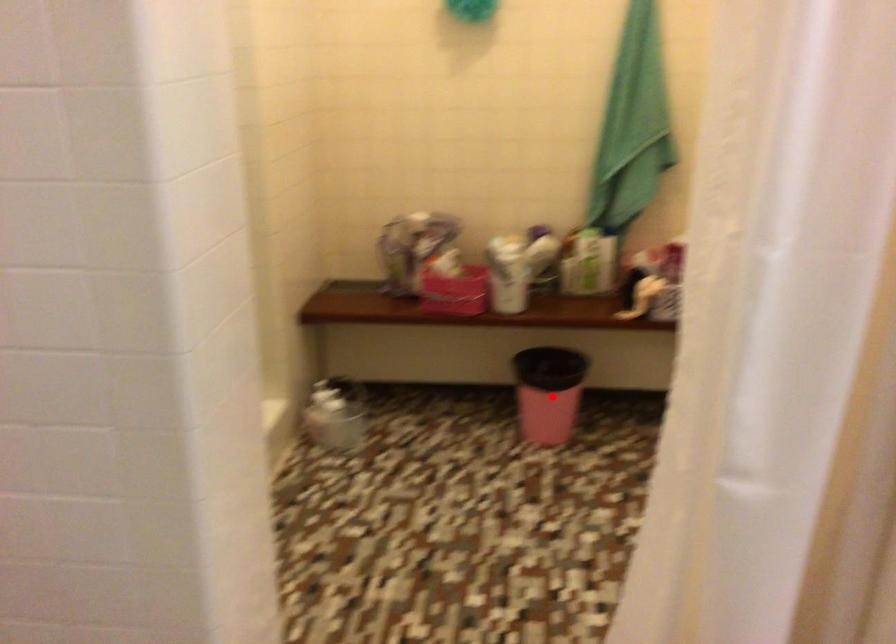
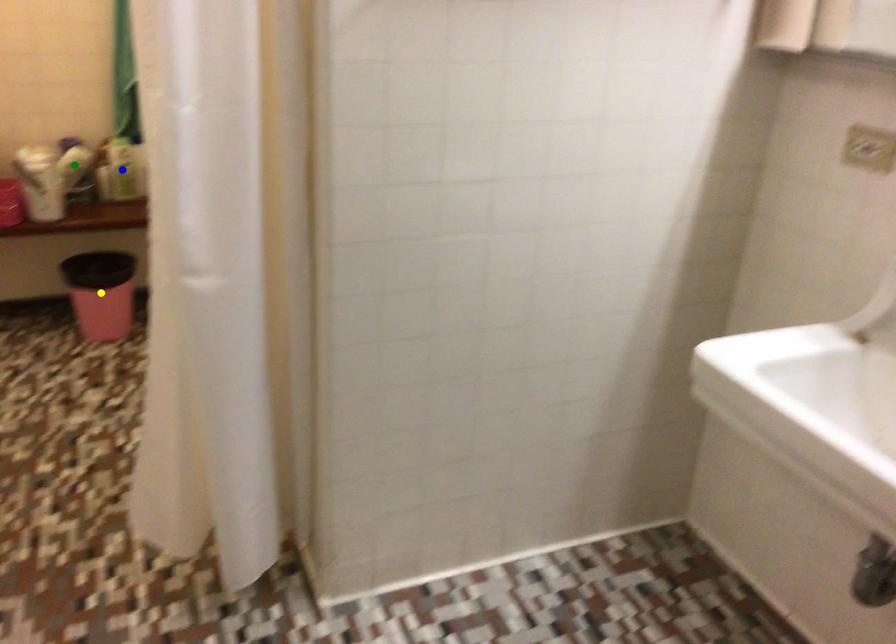
Question: I am providing you with two images of the same scene from different viewpoints. A red point is marked on the first image. You are given multiple points on the second image. Which spot in image 2 lines up with the point in image 1?

Choices:
 (A) blue point
 (B) green point
 (C) yellow point

Answer: (C)